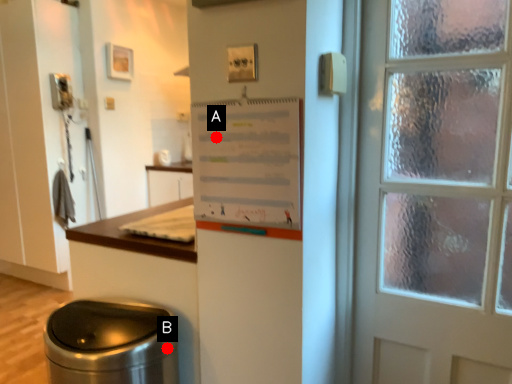
Question: Two points are circled on the image, labeled by A and B beside each circle. Which of the following is the closest to the observer?

Choices:
 (A) A is closer
 (B) B is closer

Answer: (A)